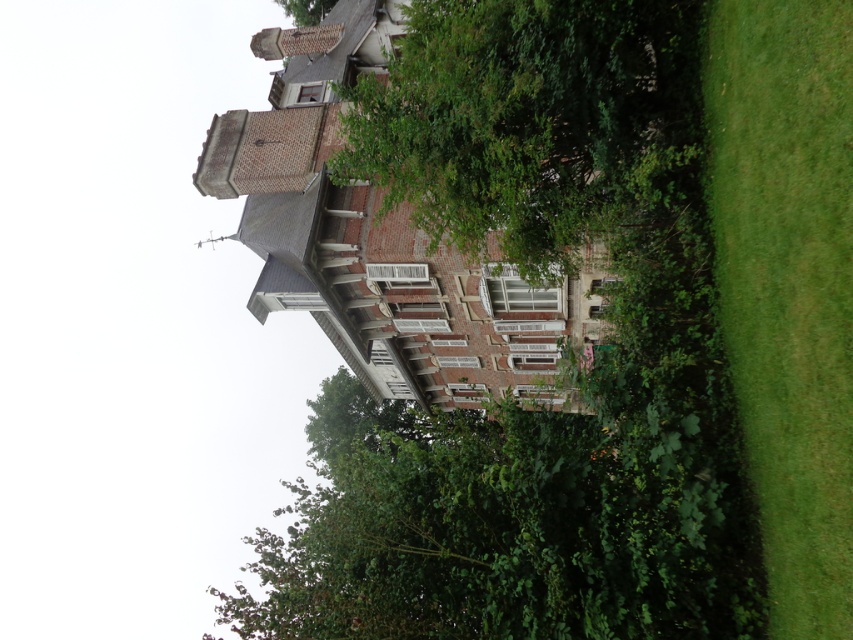
Question: From the image, what is the correct spatial relationship of green leafy tree at center in relation to green grass at right?

Choices:
 (A) below
 (B) above

Answer: (B)

Question: Among these points, which one is farthest from the camera?

Choices:
 (A) (808, 202)
 (B) (339, 173)

Answer: (B)

Question: Can you confirm if green leafy tree at center is positioned below green grass at right?

Choices:
 (A) no
 (B) yes

Answer: (A)

Question: Can you confirm if green leafy tree at center is positioned to the left of green grass at right?

Choices:
 (A) no
 (B) yes

Answer: (B)

Question: Which point is farther from the camera taking this photo?

Choices:
 (A) [x=527, y=168]
 (B) [x=729, y=70]

Answer: (A)